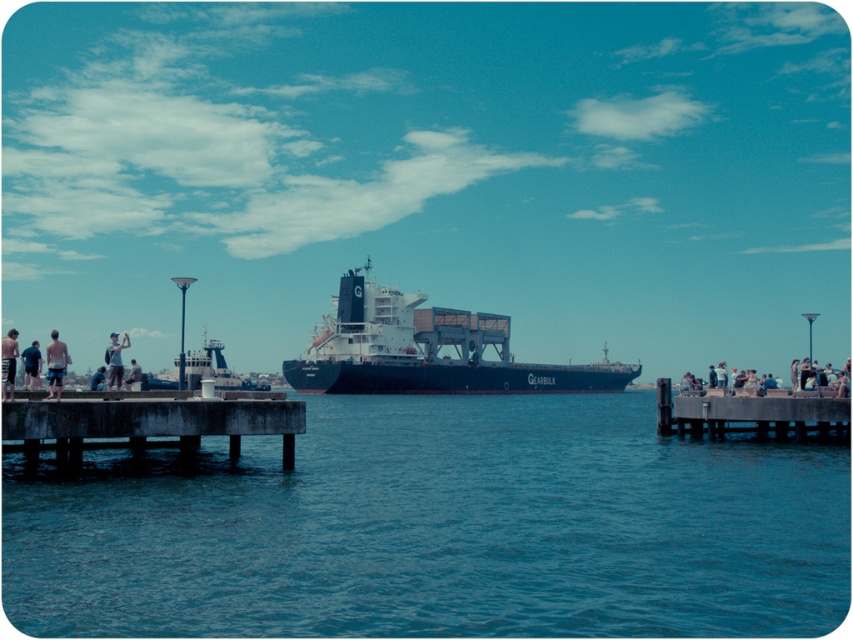
Who is positioned more to the right, tan skin person at lower left or light blue denim shorts at left?

light blue denim shorts at left

Does tan skin person at lower left lie behind light blue denim shorts at left?

No, tan skin person at lower left is closer to the viewer.

Between point (50, 396) and point (119, 362), which one is positioned behind?

The point (119, 362) is more distant.

Locate an element on the screen. Image resolution: width=853 pixels, height=640 pixels. tan skin person at lower left is located at coordinates (55, 364).

Can you confirm if blue matte cargo ship at center is positioned below light blue denim jeans at right?

Incorrect, blue matte cargo ship at center is not positioned below light blue denim jeans at right.

Which is more to the left, blue matte cargo ship at center or light blue denim jeans at right?

blue matte cargo ship at center

Between point (357, 339) and point (795, 380), which one is positioned in front?

Point (795, 380) is more forward.

You are a GUI agent. You are given a task and a screenshot of the screen. Output one action in this format:
    pyautogui.click(x=<x>, y=<y>)
    Task: Click on the blue matte cargo ship at center
    
    Given the screenshot: What is the action you would take?
    pyautogui.click(x=427, y=349)

Consider the image. Which is more to the left, concrete pier at right or metallic gray ship at center?

metallic gray ship at center is more to the left.

In the scene shown: Does concrete pier at right have a greater width compared to metallic gray ship at center?

No.

Locate an element on the screen. concrete pier at right is located at coordinates (750, 413).

Locate an element on the screen. concrete pier at right is located at coordinates point(750,413).